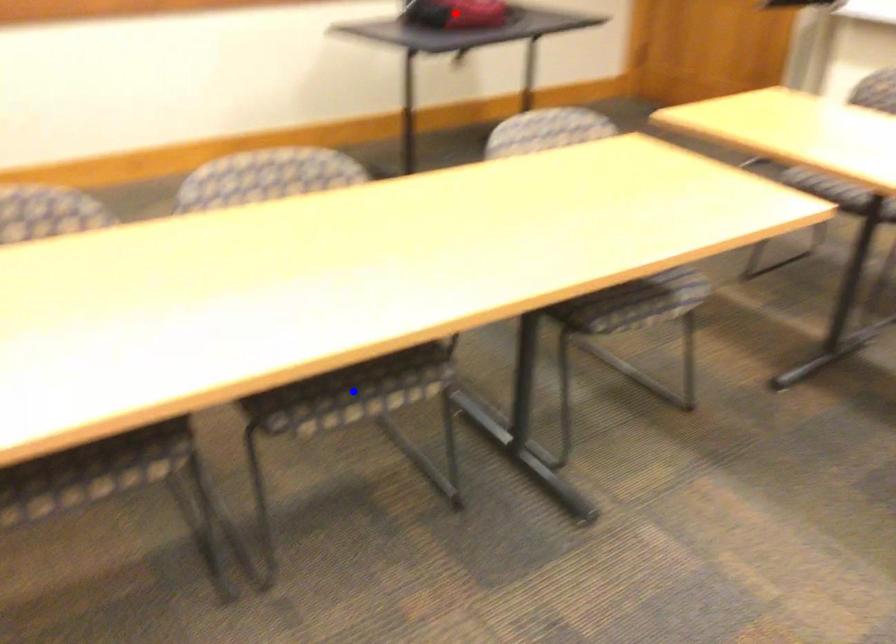
Question: Which of the two points in the image is closer to the camera?

Choices:
 (A) Blue point is closer.
 (B) Red point is closer.

Answer: (A)